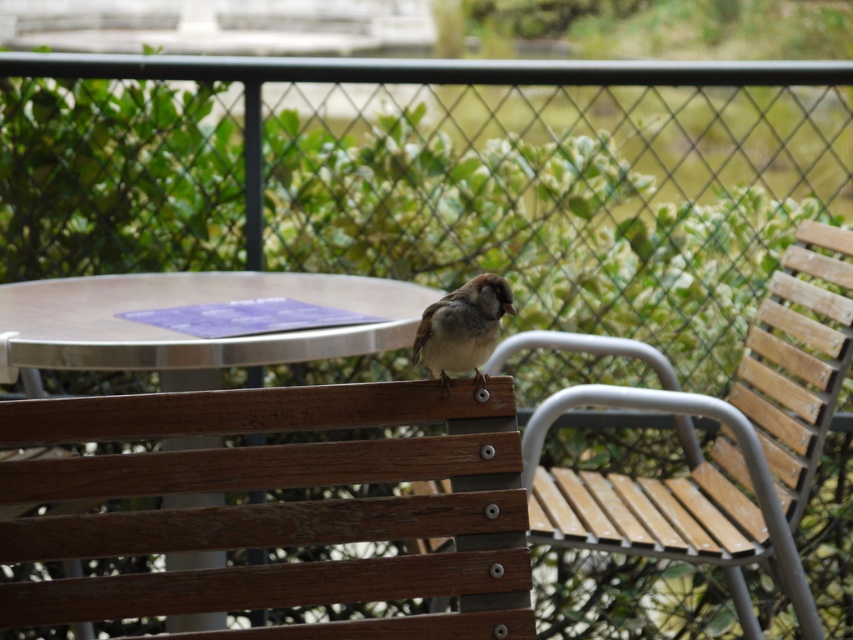
You are standing on the balcony and want to place a 8.5 feet long ladder against the chain link fence. The ladder needs to be placed exactly where the metallic silver table at center is currently located. Is there enough space to do this without the ladder hitting the table?

The metallic silver table at center is 7.99 feet away from the viewer. Since the ladder is 8.5 feet long, it would extend beyond the table by approximately 0.51 feet. Therefore, placing the ladder at the table location would cause it to hit the table unless adjusted.

You are sitting on the wooden bench and want to place a book on the metallic silver table at center. To reach the table, should you move your hand upward or downward from the wooden slats at center?

The wooden slats at center is below the metallic silver table at center, so you should move your hand upward to reach the table.